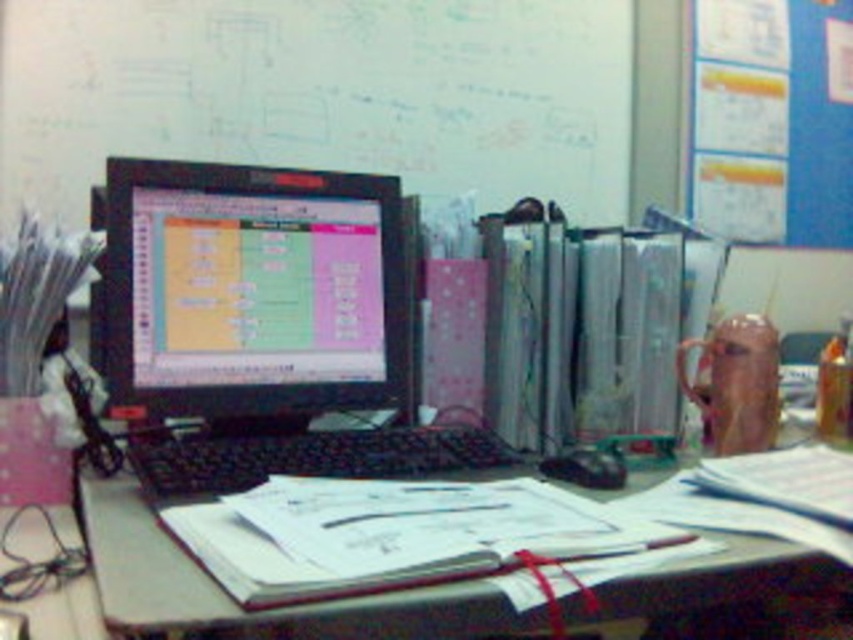
You are trying to locate your keyboard in a busy office setup. You see the matte black monitor at center and the black plastic keyboard at center. Which object is positioned to the right?

The black plastic keyboard at center is to the right of the matte black monitor at center.

You are an office worker who needs to write a note. You have a marker in your hand and see the whiteboard at upper center and the matte black monitor at center. Which surface can you use to write on?

The whiteboard at upper center can be used to write on since it is taller than the matte black monitor at center and is designed for writing with markers.